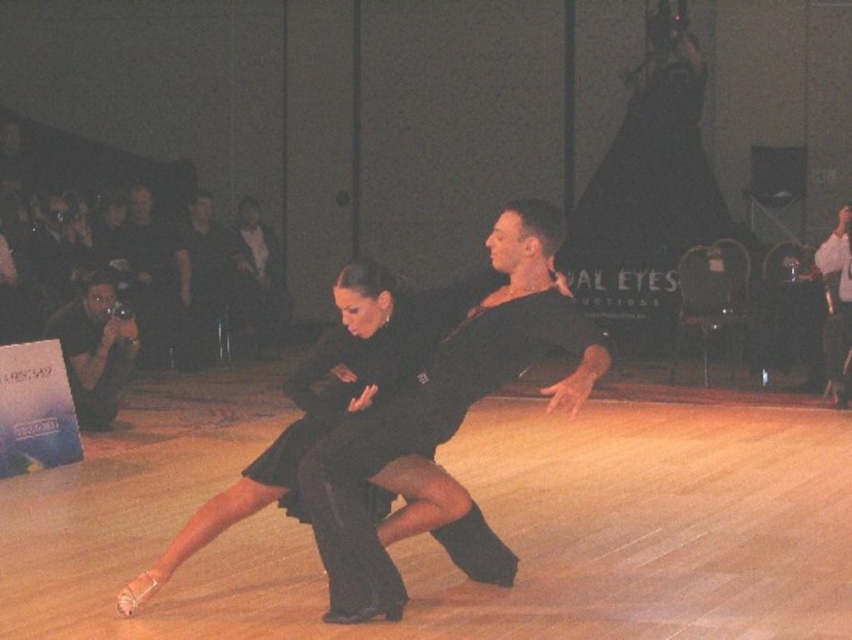
Question: Which object is closer to the camera taking this photo?

Choices:
 (A) black satin dress at center
 (B) matte black camera at left
 (C) black satin suit at right

Answer: (A)

Question: Which point appears closest to the camera in this image?

Choices:
 (A) (836, 365)
 (B) (102, 317)
 (C) (499, 308)

Answer: (C)

Question: Does matte black camera at left appear on the right side of black satin suit at right?

Choices:
 (A) no
 (B) yes

Answer: (A)

Question: Considering the real-world distances, which object is farthest from the black satin dress at center?

Choices:
 (A) matte black camera at left
 (B) black satin suit at right

Answer: (B)

Question: Can you confirm if matte black camera at left is positioned to the left of black satin suit at right?

Choices:
 (A) yes
 (B) no

Answer: (A)

Question: Can you confirm if black satin dress at center is positioned below matte black camera at left?

Choices:
 (A) yes
 (B) no

Answer: (A)